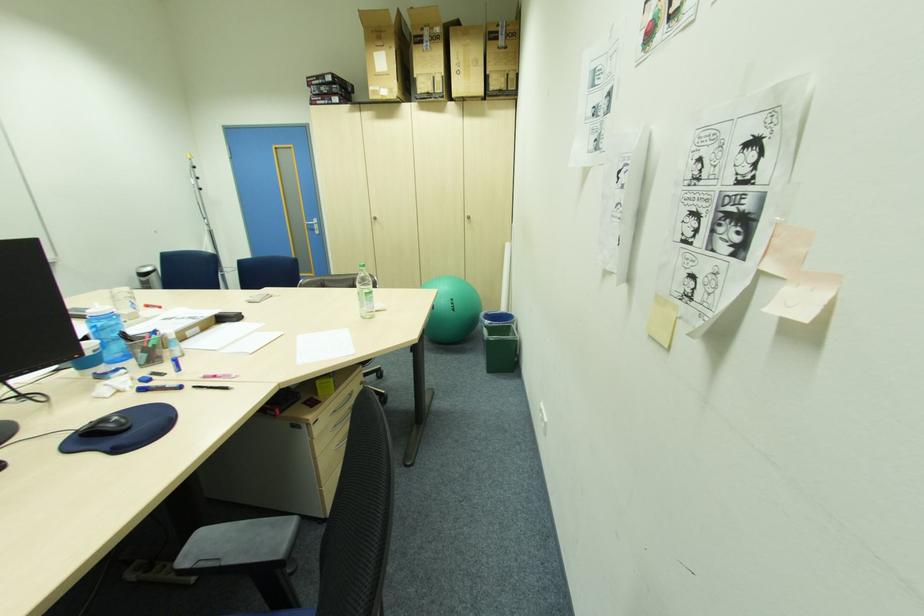
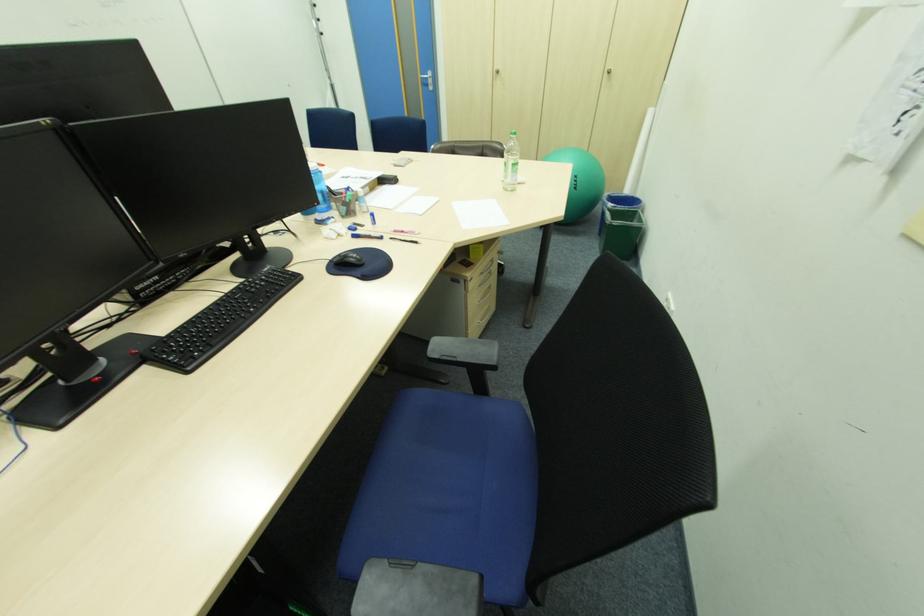
Find the pixel in the second image that matches the point at 476,224 in the first image.

(615, 79)